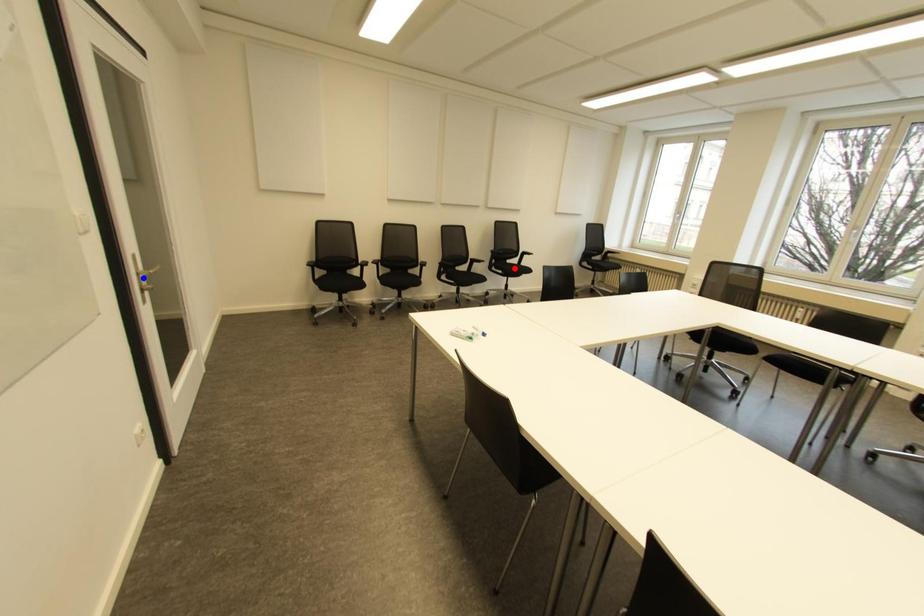
Question: Which of the two points in the image is closer to the camera?

Choices:
 (A) Blue point is closer.
 (B) Red point is closer.

Answer: (A)